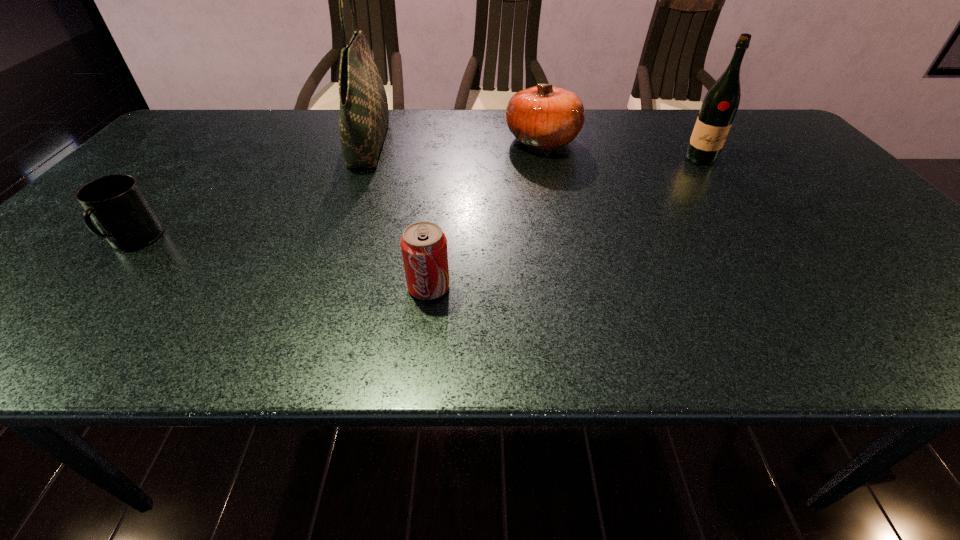
You are a GUI agent. You are given a task and a screenshot of the screen. Output one action in this format:
    pyautogui.click(x=<x>, y=<y>)
    Task: Click on the fourth object from right to left
    
    Given the screenshot: What is the action you would take?
    pyautogui.click(x=364, y=116)

Image resolution: width=960 pixels, height=540 pixels. What are the coordinates of `the tallest object` in the screenshot? It's located at (364, 116).

Where is `the fourth shortest object`? The image size is (960, 540). the fourth shortest object is located at coordinates (719, 107).

Locate an element on the screen. This screenshot has width=960, height=540. the rightmost object is located at coordinates (719, 107).

You are a GUI agent. You are given a task and a screenshot of the screen. Output one action in this format:
    pyautogui.click(x=<x>, y=<y>)
    Task: Click on the fourth object from left to right
    This screenshot has height=540, width=960.
    Given the screenshot: What is the action you would take?
    pyautogui.click(x=544, y=117)

At what (x,y) coordinates should I click in order to perform the action: click on the third object from right to left. Please return your answer as a coordinate pair (x, y). Looking at the image, I should click on (424, 245).

Locate an element on the screen. The width and height of the screenshot is (960, 540). the nearest object is located at coordinates (424, 245).

The height and width of the screenshot is (540, 960). Identify the location of the leftmost object. (116, 204).

This screenshot has width=960, height=540. I want to click on mug, so click(x=116, y=204).

At what (x,y) coordinates should I click in order to perform the action: click on free space located on the front of the tote bag. Please return your answer as a coordinate pair (x, y). Looking at the image, I should click on (329, 250).